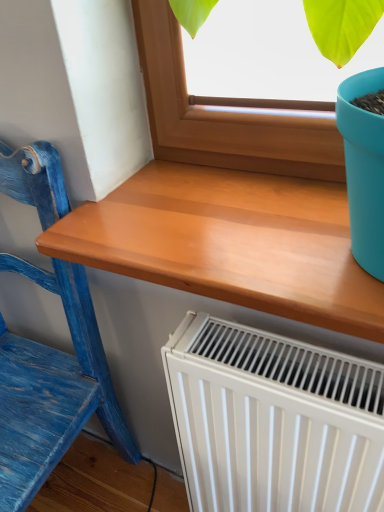
What do you see at coordinates (53, 389) in the screenshot? I see `blue wood chair at left` at bounding box center [53, 389].

Identify the location of blue wood chair at left. This screenshot has height=512, width=384. (53, 389).

Locate an element on the screen. blue wood chair at left is located at coordinates (53, 389).